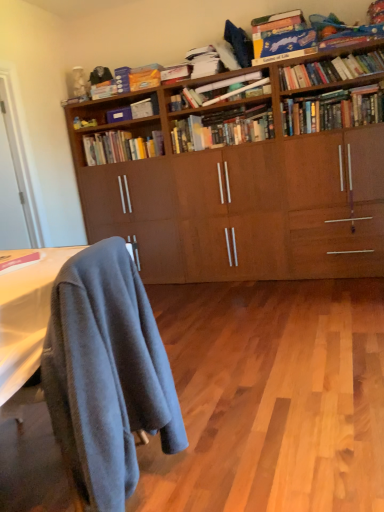
Question: From the image's perspective, is hardcover books at center, arranged as the 3th book when ordered from the bottom, beneath matte cardboard box at upper center, the 5th book when ordered from top to bottom?

Choices:
 (A) no
 (B) yes

Answer: (B)

Question: From a real-world perspective, is hardcover books at center, arranged as the 3th book when ordered from the bottom, physically below matte cardboard box at upper center, the 5th book when ordered from top to bottom?

Choices:
 (A) yes
 (B) no

Answer: (A)

Question: Is the position of hardcover books at center, the ninth book viewed from the top, more distant than that of matte cardboard box at upper center, the 5th book when ordered from top to bottom?

Choices:
 (A) no
 (B) yes

Answer: (A)

Question: Considering the relative sizes of hardcover books at center, the ninth book viewed from the top, and matte cardboard box at upper center, the 5th book when ordered from top to bottom, in the image provided, is hardcover books at center, the ninth book viewed from the top, shorter than matte cardboard box at upper center, the 5th book when ordered from top to bottom,?

Choices:
 (A) yes
 (B) no

Answer: (B)

Question: Does hardcover books at center, arranged as the 3th book when ordered from the bottom, have a lesser width compared to matte cardboard box at upper center, the 5th book when ordered from top to bottom?

Choices:
 (A) yes
 (B) no

Answer: (B)

Question: Considering the relative sizes of hardcover books at center, the ninth book viewed from the top, and matte cardboard box at upper center, the 5th book when ordered from top to bottom, in the image provided, is hardcover books at center, the ninth book viewed from the top, smaller than matte cardboard box at upper center, the 5th book when ordered from top to bottom,?

Choices:
 (A) no
 (B) yes

Answer: (A)

Question: Is hardcover books at center, the ninth book viewed from the top, turned away from hardcover books at upper right, the sixth book when ordered from bottom to top?

Choices:
 (A) no
 (B) yes

Answer: (A)

Question: From the image's perspective, is hardcover books at center, arranged as the 3th book when ordered from the bottom, on top of hardcover books at upper right, arranged as the 6th book when viewed from the top?

Choices:
 (A) no
 (B) yes

Answer: (A)

Question: Is hardcover books at center, the ninth book viewed from the top, touching hardcover books at upper right, arranged as the 6th book when viewed from the top?

Choices:
 (A) yes
 (B) no

Answer: (B)

Question: Is hardcover books at center, arranged as the 3th book when ordered from the bottom, positioned behind hardcover books at upper right, the sixth book when ordered from bottom to top?

Choices:
 (A) no
 (B) yes

Answer: (B)

Question: Is hardcover books at center, the ninth book viewed from the top, located outside hardcover books at upper right, the sixth book when ordered from bottom to top?

Choices:
 (A) yes
 (B) no

Answer: (A)

Question: Is hardcover books at center, the ninth book viewed from the top, shorter than hardcover books at upper right, the sixth book when ordered from bottom to top?

Choices:
 (A) no
 (B) yes

Answer: (A)

Question: Can you confirm if matte pink book at lower left, the eleventh book from the top, is smaller than hardcover books at center, the ninth book viewed from the top?

Choices:
 (A) no
 (B) yes

Answer: (B)